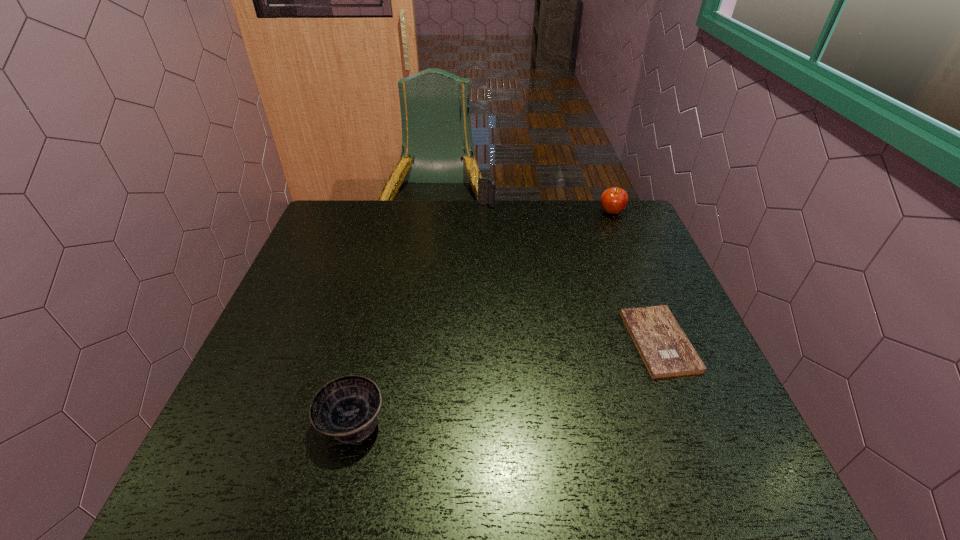
At what (x,y) coordinates should I click in order to perform the action: click on free location located on the front of the shortest object. Please return your answer as a coordinate pair (x, y). Looking at the image, I should click on (684, 403).

Identify the location of cellular telephone located at the far edge. The height and width of the screenshot is (540, 960). (486, 187).

Locate an element on the screen. Image resolution: width=960 pixels, height=540 pixels. apple situated at the far edge is located at coordinates (613, 200).

The height and width of the screenshot is (540, 960). In order to click on object that is positioned at the near edge in this screenshot , I will do `click(346, 408)`.

This screenshot has width=960, height=540. I want to click on apple present at the right edge, so click(x=613, y=200).

Image resolution: width=960 pixels, height=540 pixels. Find the location of `Bible situated at the right edge`. Bible situated at the right edge is located at coordinates (666, 351).

The height and width of the screenshot is (540, 960). I want to click on object present at the far right corner, so click(x=613, y=200).

Where is `vacant space at the far edge of the desktop`? The image size is (960, 540). vacant space at the far edge of the desktop is located at coordinates (495, 206).

In the image, there is a desktop. Where is `vacant space at the near edge`? This screenshot has width=960, height=540. vacant space at the near edge is located at coordinates (357, 464).

Locate an element on the screen. The image size is (960, 540). free region at the left edge is located at coordinates (331, 302).